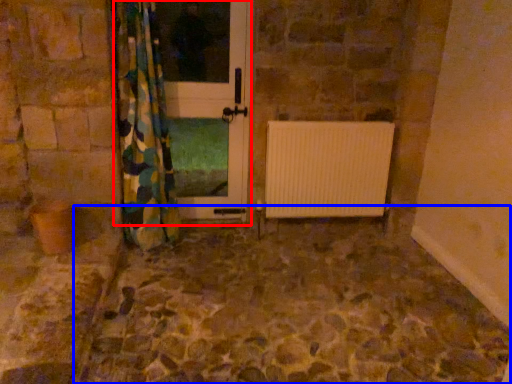
Question: Which object appears closest to the camera in this image, screen door (highlighted by a red box) or path (highlighted by a blue box)?

Choices:
 (A) screen door
 (B) path

Answer: (B)